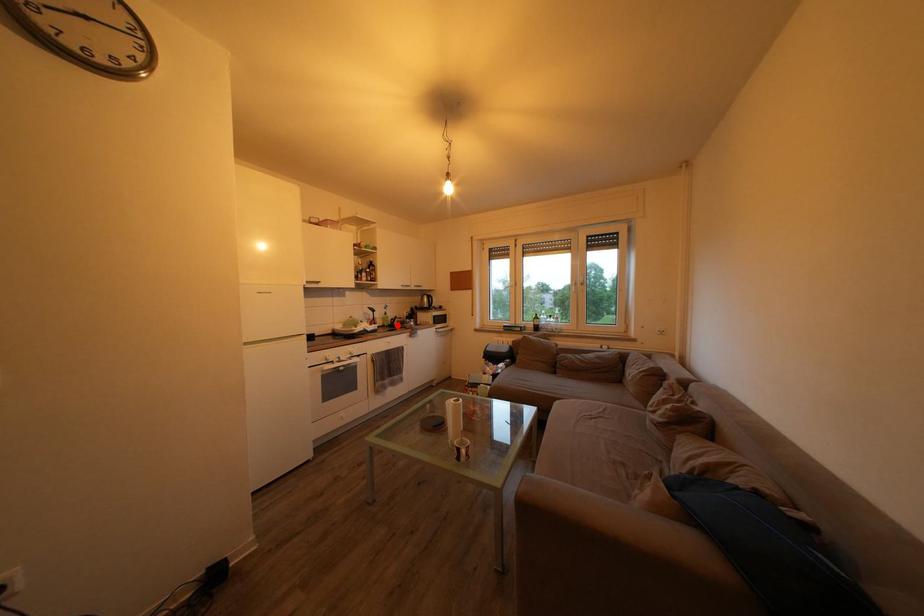
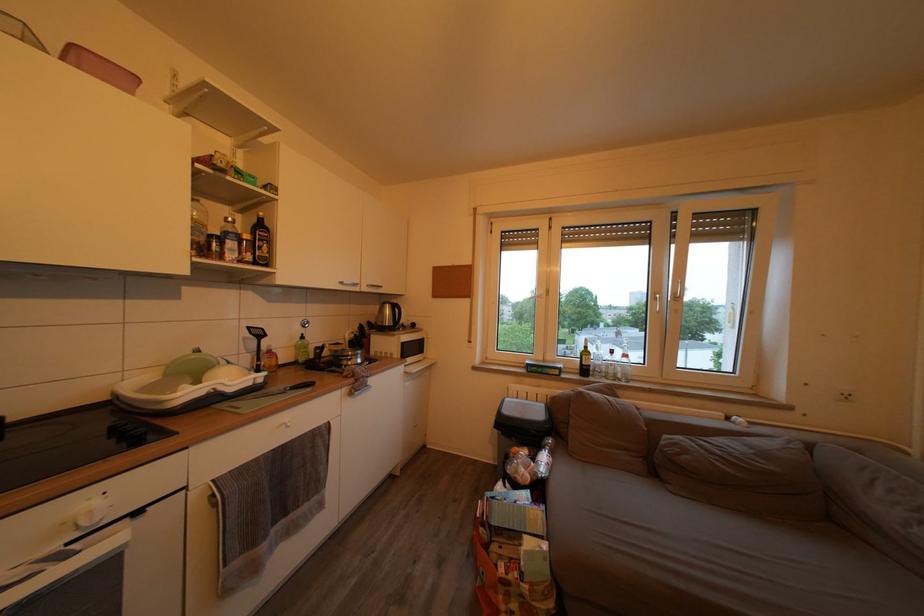
The point at the highlighted location is marked in the first image. Where is the corresponding point in the second image?

(320, 353)